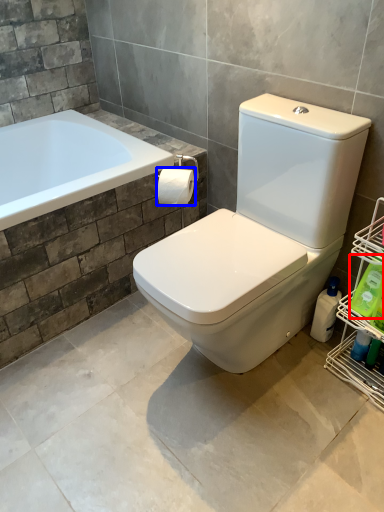
Question: Among these objects, which one is farthest to the camera, cleaning product (highlighted by a red box) or toilet paper (highlighted by a blue box)?

Choices:
 (A) cleaning product
 (B) toilet paper

Answer: (B)